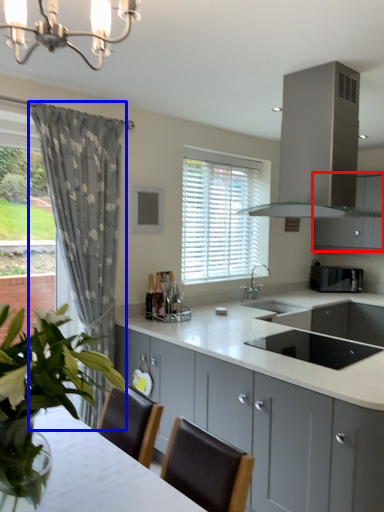
Question: Which of the following is the farthest to the observer, cabinetry (highlighted by a red box) or curtain (highlighted by a blue box)?

Choices:
 (A) cabinetry
 (B) curtain

Answer: (A)